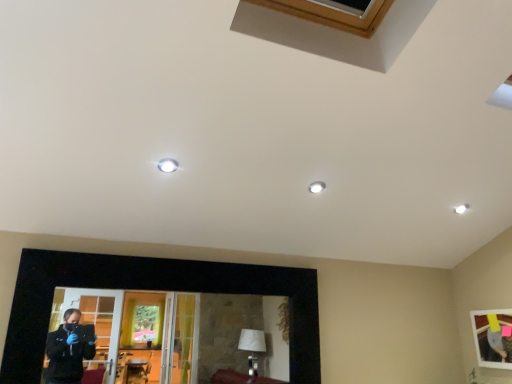
What do you see at coordinates (151, 289) in the screenshot?
I see `black matte picture frame at lower center, which ranks as the second picture frame in right-to-left order` at bounding box center [151, 289].

I want to click on black matte picture frame at lower center, which ranks as the 1th picture frame in left-to-right order, so click(151, 289).

You are a GUI agent. You are given a task and a screenshot of the screen. Output one action in this format:
    pyautogui.click(x=<x>, y=<y>)
    Task: Click on the wooden framed picture at lower right, the first picture frame from the right
    Image resolution: width=512 pixels, height=384 pixels.
    Given the screenshot: What is the action you would take?
    pyautogui.click(x=493, y=337)

The image size is (512, 384). Describe the element at coordinates (493, 337) in the screenshot. I see `wooden framed picture at lower right, marked as the second picture frame in a left-to-right arrangement` at that location.

Where is `black matte picture frame at lower center, which ranks as the 1th picture frame in left-to-right order`? This screenshot has height=384, width=512. black matte picture frame at lower center, which ranks as the 1th picture frame in left-to-right order is located at coordinates (151, 289).

Is wooden framed picture at lower right, marked as the second picture frame in a left-to-right arrangement, at the left side of black matte picture frame at lower center, which ranks as the 1th picture frame in left-to-right order?

No.

Is wooden framed picture at lower right, marked as the second picture frame in a left-to-right arrangement, further to camera compared to black matte picture frame at lower center, which ranks as the 1th picture frame in left-to-right order?

→ Yes, it is.

Is point (487, 310) less distant than point (303, 320)?

No, it is behind (303, 320).

In the scene shown: From the image's perspective, which is below, wooden framed picture at lower right, marked as the second picture frame in a left-to-right arrangement, or black matte picture frame at lower center, which ranks as the second picture frame in right-to-left order?

From the image's view, wooden framed picture at lower right, marked as the second picture frame in a left-to-right arrangement, is below.

From a real-world perspective, which is physically below, wooden framed picture at lower right, marked as the second picture frame in a left-to-right arrangement, or black matte picture frame at lower center, which ranks as the 1th picture frame in left-to-right order?

wooden framed picture at lower right, marked as the second picture frame in a left-to-right arrangement, from a real-world perspective.

Is wooden framed picture at lower right, marked as the second picture frame in a left-to-right arrangement, thinner than black matte picture frame at lower center, which ranks as the second picture frame in right-to-left order?

Correct, the width of wooden framed picture at lower right, marked as the second picture frame in a left-to-right arrangement, is less than that of black matte picture frame at lower center, which ranks as the second picture frame in right-to-left order.

Which of these two, wooden framed picture at lower right, marked as the second picture frame in a left-to-right arrangement, or black matte picture frame at lower center, which ranks as the 1th picture frame in left-to-right order, stands shorter?

Standing shorter between the two is wooden framed picture at lower right, marked as the second picture frame in a left-to-right arrangement.

Does wooden framed picture at lower right, marked as the second picture frame in a left-to-right arrangement, have a larger size compared to black matte picture frame at lower center, which ranks as the second picture frame in right-to-left order?

Actually, wooden framed picture at lower right, marked as the second picture frame in a left-to-right arrangement, might be smaller than black matte picture frame at lower center, which ranks as the second picture frame in right-to-left order.

In the scene shown: Is wooden framed picture at lower right, the first picture frame from the right, positioned beyond the bounds of black matte picture frame at lower center, which ranks as the 1th picture frame in left-to-right order?

Yes, wooden framed picture at lower right, the first picture frame from the right, is not within black matte picture frame at lower center, which ranks as the 1th picture frame in left-to-right order.

Is wooden framed picture at lower right, marked as the second picture frame in a left-to-right arrangement, beside black matte picture frame at lower center, which ranks as the 1th picture frame in left-to-right order?

A: No, wooden framed picture at lower right, marked as the second picture frame in a left-to-right arrangement, is not next to black matte picture frame at lower center, which ranks as the 1th picture frame in left-to-right order.

From the picture: Is wooden framed picture at lower right, marked as the second picture frame in a left-to-right arrangement, positioned with its back to black matte picture frame at lower center, which ranks as the 1th picture frame in left-to-right order?

No, wooden framed picture at lower right, marked as the second picture frame in a left-to-right arrangement, is not facing away from black matte picture frame at lower center, which ranks as the 1th picture frame in left-to-right order.

How distant is wooden framed picture at lower right, marked as the second picture frame in a left-to-right arrangement, from black matte picture frame at lower center, which ranks as the 1th picture frame in left-to-right order?

wooden framed picture at lower right, marked as the second picture frame in a left-to-right arrangement, is 1.75 meters away from black matte picture frame at lower center, which ranks as the 1th picture frame in left-to-right order.

Where is `picture frame that appears on the right of black matte picture frame at lower center, which ranks as the second picture frame in right-to-left order`? Image resolution: width=512 pixels, height=384 pixels. picture frame that appears on the right of black matte picture frame at lower center, which ranks as the second picture frame in right-to-left order is located at coordinates click(x=493, y=337).

Which object is positioned more to the left, black matte picture frame at lower center, which ranks as the second picture frame in right-to-left order, or wooden framed picture at lower right, marked as the second picture frame in a left-to-right arrangement?

From the viewer's perspective, black matte picture frame at lower center, which ranks as the second picture frame in right-to-left order, appears more on the left side.

Who is more distant, black matte picture frame at lower center, which ranks as the second picture frame in right-to-left order, or wooden framed picture at lower right, marked as the second picture frame in a left-to-right arrangement?

wooden framed picture at lower right, marked as the second picture frame in a left-to-right arrangement, is more distant.

Which point is more distant from viewer, (85, 286) or (511, 319)?

Point (511, 319)

From the image's perspective, does black matte picture frame at lower center, which ranks as the 1th picture frame in left-to-right order, appear lower than wooden framed picture at lower right, the first picture frame from the right?

No, from the image's perspective, black matte picture frame at lower center, which ranks as the 1th picture frame in left-to-right order, is not below wooden framed picture at lower right, the first picture frame from the right.

From a real-world perspective, is black matte picture frame at lower center, which ranks as the 1th picture frame in left-to-right order, below wooden framed picture at lower right, marked as the second picture frame in a left-to-right arrangement?

No.

Between black matte picture frame at lower center, which ranks as the 1th picture frame in left-to-right order, and wooden framed picture at lower right, marked as the second picture frame in a left-to-right arrangement, which one has larger width?

black matte picture frame at lower center, which ranks as the 1th picture frame in left-to-right order, is wider.

Is black matte picture frame at lower center, which ranks as the second picture frame in right-to-left order, taller than wooden framed picture at lower right, the first picture frame from the right?

Yes, black matte picture frame at lower center, which ranks as the second picture frame in right-to-left order, is taller than wooden framed picture at lower right, the first picture frame from the right.

Looking at this image, based on their sizes in the image, would you say black matte picture frame at lower center, which ranks as the second picture frame in right-to-left order, is bigger or smaller than wooden framed picture at lower right, marked as the second picture frame in a left-to-right arrangement?

Considering their sizes, black matte picture frame at lower center, which ranks as the second picture frame in right-to-left order, takes up more space than wooden framed picture at lower right, marked as the second picture frame in a left-to-right arrangement.

Would you say wooden framed picture at lower right, marked as the second picture frame in a left-to-right arrangement, is part of black matte picture frame at lower center, which ranks as the 1th picture frame in left-to-right order,'s contents?

That's incorrect, wooden framed picture at lower right, marked as the second picture frame in a left-to-right arrangement, is not inside black matte picture frame at lower center, which ranks as the 1th picture frame in left-to-right order.

Is black matte picture frame at lower center, which ranks as the second picture frame in right-to-left order, not near wooden framed picture at lower right, the first picture frame from the right?

Yes, black matte picture frame at lower center, which ranks as the second picture frame in right-to-left order, is far from wooden framed picture at lower right, the first picture frame from the right.

Is black matte picture frame at lower center, which ranks as the second picture frame in right-to-left order, positioned with its back to wooden framed picture at lower right, marked as the second picture frame in a left-to-right arrangement?

No, black matte picture frame at lower center, which ranks as the second picture frame in right-to-left order, is not facing away from wooden framed picture at lower right, marked as the second picture frame in a left-to-right arrangement.

How different are the orientations of black matte picture frame at lower center, which ranks as the 1th picture frame in left-to-right order, and wooden framed picture at lower right, the first picture frame from the right, in degrees?

There is a 89.7-degree angle between the facing directions of black matte picture frame at lower center, which ranks as the 1th picture frame in left-to-right order, and wooden framed picture at lower right, the first picture frame from the right.

What are the coordinates of `picture frame that appears above the wooden framed picture at lower right, the first picture frame from the right (from the image's perspective)` in the screenshot? It's located at (151, 289).

Identify the location of picture frame on the right side of black matte picture frame at lower center, which ranks as the 1th picture frame in left-to-right order. This screenshot has width=512, height=384. (493, 337).

The height and width of the screenshot is (384, 512). I want to click on picture frame below the black matte picture frame at lower center, which ranks as the 1th picture frame in left-to-right order (from the image's perspective), so click(x=493, y=337).